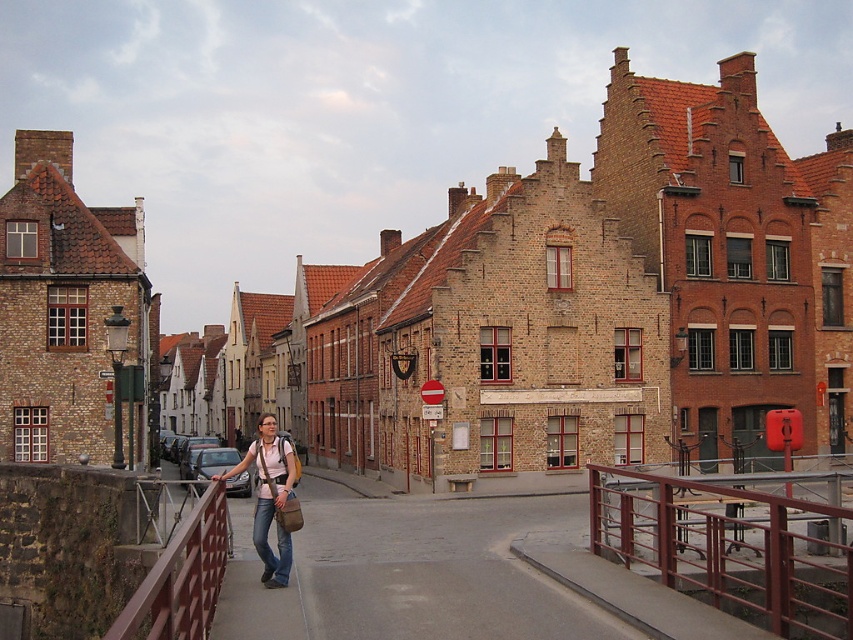
Does brown brick building at center come in front of metallic red railing at center?

No, brown brick building at center is behind metallic red railing at center.

Does brown brick building at center appear over metallic red railing at center?

Yes, brown brick building at center is above metallic red railing at center.

Where is `brown brick building at center`? This screenshot has width=853, height=640. brown brick building at center is located at coordinates (587, 305).

You are a GUI agent. You are given a task and a screenshot of the screen. Output one action in this format:
    pyautogui.click(x=<x>, y=<y>)
    Task: Click on the brown brick building at center
    
    Given the screenshot: What is the action you would take?
    pyautogui.click(x=587, y=305)

Who is shorter, metallic red railing at center or matte pink shirt at center?

With less height is metallic red railing at center.

Can you confirm if metallic red railing at center is positioned to the right of matte pink shirt at center?

Correct, you'll find metallic red railing at center to the right of matte pink shirt at center.

Which is in front, point (653, 490) or point (280, 563)?

Point (280, 563) is more forward.

Where is `metallic red railing at center`? metallic red railing at center is located at coordinates (730, 548).

Between brown brick building at center and brown metal/rail at center, which one has less height?

brown metal/rail at center is shorter.

Which is in front, point (561, 275) or point (171, 611)?

Point (171, 611) is in front.

You are a GUI agent. You are given a task and a screenshot of the screen. Output one action in this format:
    pyautogui.click(x=<x>, y=<y>)
    Task: Click on the brown brick building at center
    This screenshot has height=640, width=853.
    Given the screenshot: What is the action you would take?
    pyautogui.click(x=587, y=305)